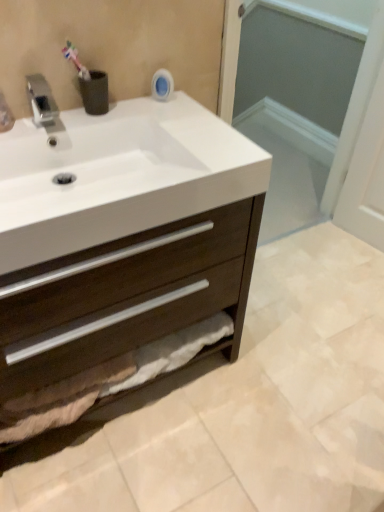
Question: From the image's perspective, is transparent glass screen door at upper center positioned above or below silver metallic faucet at upper left?

Choices:
 (A) above
 (B) below

Answer: (A)

Question: In terms of size, does transparent glass screen door at upper center appear bigger or smaller than silver metallic faucet at upper left?

Choices:
 (A) small
 (B) big

Answer: (B)

Question: Estimate the real-world distances between objects in this image. Which object is farther from the dark wood cabinet at center?

Choices:
 (A) transparent glass screen door at upper center
 (B) white glossy sink at upper left
 (C) silver metallic faucet at upper left

Answer: (A)

Question: Considering the real-world distances, which object is closest to the transparent glass screen door at upper center?

Choices:
 (A) dark wood cabinet at center
 (B) silver metallic faucet at upper left
 (C) white glossy sink at upper left

Answer: (A)